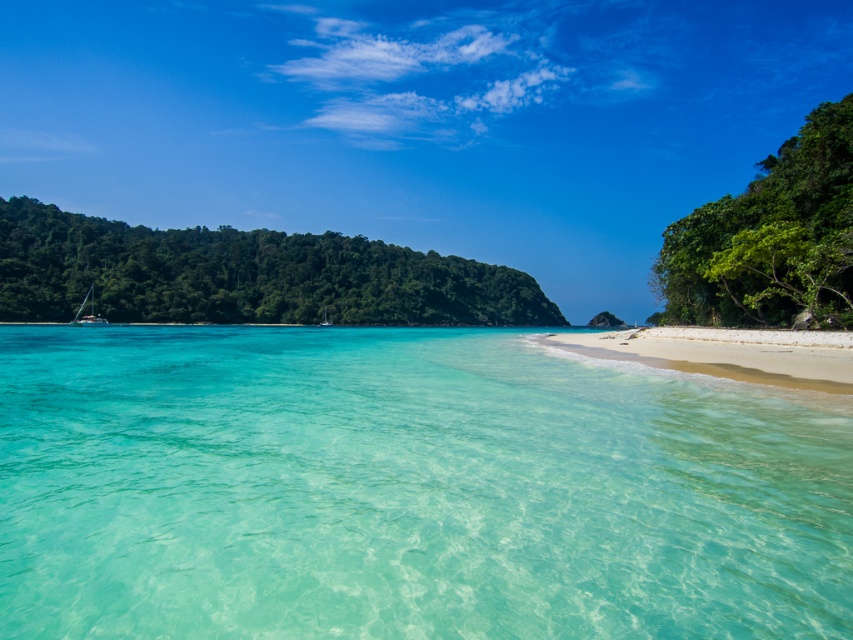
Question: Which point appears closest to the camera in this image?

Choices:
 (A) (79, 314)
 (B) (329, 321)

Answer: (A)

Question: Which object is positioned farthest from the green leafy island at left?

Choices:
 (A) transparent water at center
 (B) white glossy boat at center

Answer: (A)

Question: Does white sand beach at lower right lie in front of white glossy sailboat at left?

Choices:
 (A) yes
 (B) no

Answer: (A)

Question: Can you confirm if green leafy island at left is wider than white glossy boat at center?

Choices:
 (A) no
 (B) yes

Answer: (B)

Question: Which point is closer to the camera taking this photo?

Choices:
 (A) (83, 588)
 (B) (93, 305)

Answer: (A)

Question: Does transparent water at center have a larger size compared to white sand beach at lower right?

Choices:
 (A) no
 (B) yes

Answer: (B)